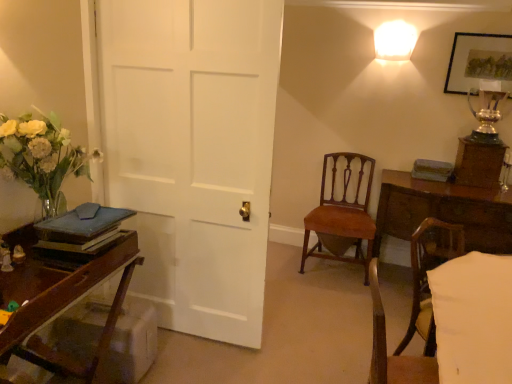
This screenshot has width=512, height=384. In order to click on matte glass vase with flowers at left in this screenshot , I will do `click(42, 157)`.

This screenshot has width=512, height=384. Identify the location of wooden desk at left. (65, 302).

The image size is (512, 384). I want to click on white frosted glass sconce at upper right, so click(395, 40).

From a real-world perspective, is wooden picture frame at upper right physically below silver metallic trophy at upper right?

No.

Would you say silver metallic trophy at upper right is part of wooden picture frame at upper right's contents?

That's incorrect, silver metallic trophy at upper right is not inside wooden picture frame at upper right.

Is wooden picture frame at upper right positioned with its back to silver metallic trophy at upper right?

wooden picture frame at upper right is not turned away from silver metallic trophy at upper right.

Is point (458, 47) positioned in front of point (490, 91)?

Yes, point (458, 47) is in front of point (490, 91).

Is wooden picture frame at upper right outside of wooden desk at left?

Indeed, wooden picture frame at upper right is completely outside wooden desk at left.

In the scene shown: Is wooden picture frame at upper right in front of wooden desk at left?

No, the depth of wooden picture frame at upper right is greater than that of wooden desk at left.

Considering the sizes of wooden picture frame at upper right and wooden desk at left in the image, is wooden picture frame at upper right taller or shorter than wooden desk at left?

In the image, wooden picture frame at upper right appears to be shorter than wooden desk at left.

Looking at this image, looking at their sizes, would you say silver metallic trophy at upper right is wider or thinner than wooden picture frame at upper right?

silver metallic trophy at upper right is wider than wooden picture frame at upper right.

In the scene shown: How many degrees apart are the facing directions of silver metallic trophy at upper right and wooden picture frame at upper right?

The angular difference between silver metallic trophy at upper right and wooden picture frame at upper right is 1.21 degrees.

Which object is more forward, silver metallic trophy at upper right or wooden picture frame at upper right?

silver metallic trophy at upper right is more forward.

Is silver metallic trophy at upper right to the left of wooden picture frame at upper right from the viewer's perspective?

No, silver metallic trophy at upper right is not to the left of wooden picture frame at upper right.

Could you measure the distance between silver metallic trophy at upper right and white frosted glass sconce at upper right?

silver metallic trophy at upper right and white frosted glass sconce at upper right are 27.60 inches apart from each other.

Is silver metallic trophy at upper right to the left or to the right of white frosted glass sconce at upper right in the image?

silver metallic trophy at upper right is to the right of white frosted glass sconce at upper right.

Is silver metallic trophy at upper right bigger or smaller than white frosted glass sconce at upper right?

Clearly, silver metallic trophy at upper right is larger in size than white frosted glass sconce at upper right.

Does silver metallic trophy at upper right turn towards white frosted glass sconce at upper right?

No, silver metallic trophy at upper right is not aimed at white frosted glass sconce at upper right.

Which of these two, wooden desk at left or matte glass vase with flowers at left, is bigger?

With larger size is wooden desk at left.

Would you say wooden desk at left is a long distance from matte glass vase with flowers at left?

wooden desk at left is actually quite close to matte glass vase with flowers at left.

Considering the sizes of wooden desk at left and matte glass vase with flowers at left in the image, is wooden desk at left wider or thinner than matte glass vase with flowers at left?

In the image, wooden desk at left appears to be wider than matte glass vase with flowers at left.

The height and width of the screenshot is (384, 512). Identify the location of floral arrangement above the wooden desk at left (from a real-world perspective). (42, 157).

From a real-world perspective, between silver metallic trophy at upper right and mahogany wood chair at center, the 1th chair viewed from the back, who is vertically higher?

silver metallic trophy at upper right, from a real-world perspective.

Considering the sizes of objects silver metallic trophy at upper right and mahogany wood chair at center, placed as the second chair when sorted from front to back, in the image provided, who is shorter, silver metallic trophy at upper right or mahogany wood chair at center, placed as the second chair when sorted from front to back,?

Standing shorter between the two is silver metallic trophy at upper right.

From the image's perspective, is silver metallic trophy at upper right under mahogany wood chair at center, the 1th chair viewed from the back?

No.

Are silver metallic trophy at upper right and mahogany wood chair at center, the 1th chair viewed from the back, far apart?

Yes, silver metallic trophy at upper right and mahogany wood chair at center, the 1th chair viewed from the back, are quite far apart.

Is wooden picture frame at upper right not close to matte glass vase with flowers at left?

Yes, wooden picture frame at upper right and matte glass vase with flowers at left are quite far apart.

Which is in front, wooden picture frame at upper right or matte glass vase with flowers at left?

matte glass vase with flowers at left is more forward.

Can matte glass vase with flowers at left be found inside wooden picture frame at upper right?

No, wooden picture frame at upper right does not contain matte glass vase with flowers at left.

Considering the relative positions of wooden picture frame at upper right and matte glass vase with flowers at left in the image provided, is wooden picture frame at upper right to the left or to the right of matte glass vase with flowers at left?

In the image, wooden picture frame at upper right appears on the right side of matte glass vase with flowers at left.

The height and width of the screenshot is (384, 512). I want to click on picture frame on the left of silver metallic trophy at upper right, so click(x=479, y=62).

Where is `picture frame above the wooden desk at left (from the image's perspective)`? picture frame above the wooden desk at left (from the image's perspective) is located at coordinates (479, 62).

When comparing their distances from wooden desk at left, does matte glass vase with flowers at left or light brown wood chair at lower right, which ranks as the 1th chair in front-to-back order, seem closer?

matte glass vase with flowers at left is closer to wooden desk at left.

Looking at the image, which one is located closer to matte glass vase with flowers at left, mahogany wood chair at center, placed as the second chair when sorted from front to back, or white frosted glass sconce at upper right?

mahogany wood chair at center, placed as the second chair when sorted from front to back, lies closer to matte glass vase with flowers at left than the other object.

From the image, which object appears to be farther from matte glass vase with flowers at left, white frosted glass sconce at upper right or wooden desk at left?

Among the two, white frosted glass sconce at upper right is located further to matte glass vase with flowers at left.

Estimate the real-world distances between objects in this image. Which object is further from matte glass vase with flowers at left, silver metallic trophy at upper right or wooden desk at left?

The object further to matte glass vase with flowers at left is silver metallic trophy at upper right.

Which object lies further to the anchor point silver metallic trophy at upper right, matte glass vase with flowers at left or light brown wood chair at lower right, which is the second chair in back-to-front order?

matte glass vase with flowers at left is positioned further to the anchor silver metallic trophy at upper right.

Looking at the image, which one is located closer to mahogany wood chair at center, placed as the second chair when sorted from front to back, matte glass vase with flowers at left or wooden picture frame at upper right?

wooden picture frame at upper right lies closer to mahogany wood chair at center, placed as the second chair when sorted from front to back, than the other object.

Estimate the real-world distances between objects in this image. Which object is closer to mahogany wood chair at center, placed as the second chair when sorted from front to back, silver metallic trophy at upper right or light brown wood chair at lower right, which is the second chair in back-to-front order?

Among the two, light brown wood chair at lower right, which is the second chair in back-to-front order, is located nearer to mahogany wood chair at center, placed as the second chair when sorted from front to back.

Looking at the image, which one is located closer to light brown wood chair at lower right, which is the second chair in back-to-front order, silver metallic trophy at upper right or wooden picture frame at upper right?

Among the two, silver metallic trophy at upper right is located nearer to light brown wood chair at lower right, which is the second chair in back-to-front order.

I want to click on table located between wooden desk at left and wooden picture frame at upper right in the left-right direction, so click(x=440, y=214).

I want to click on picture frame between white frosted glass sconce at upper right and wooden table at right in the up-down direction, so (x=479, y=62).

The height and width of the screenshot is (384, 512). Find the location of `chair between wooden desk at left and light brown wood chair at lower right, which ranks as the 1th chair in front-to-back order, from left to right`. chair between wooden desk at left and light brown wood chair at lower right, which ranks as the 1th chair in front-to-back order, from left to right is located at coordinates (342, 216).

Identify the location of lighting between wooden desk at left and wooden picture frame at upper right in the horizontal direction. Image resolution: width=512 pixels, height=384 pixels. (395, 40).